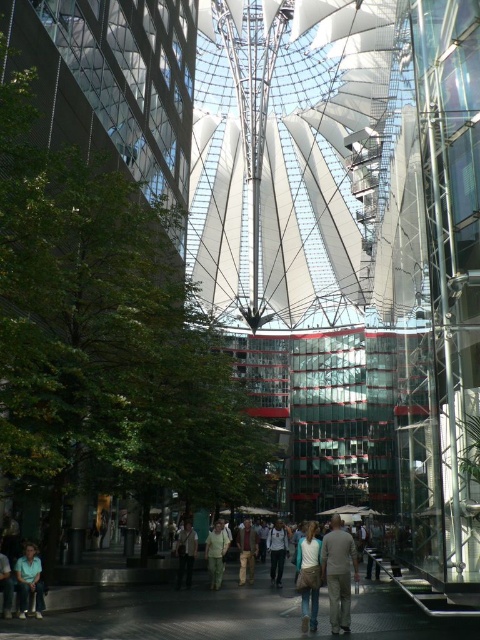
Question: Which point is closer to the camera?

Choices:
 (A) (192, 532)
 (B) (9, 579)
 (C) (310, 592)
 (D) (36, 580)

Answer: (B)

Question: Does denim jacket at center have a larger size compared to light blue jeans at lower left?

Choices:
 (A) no
 (B) yes

Answer: (B)

Question: Based on their relative distances, which object is nearer to the brown leather jacket at center?

Choices:
 (A) denim jacket at center
 (B) light blue shirt at lower left
 (C) light brown leather jacket at center
 (D) light beige pants at center

Answer: (D)

Question: Which of the following is the farthest from the observer?

Choices:
 (A) (284, 557)
 (B) (188, 557)
 (C) (337, 518)
 (D) (2, 611)

Answer: (A)

Question: Can you confirm if light blue shirt at center is positioned to the left of brown leather jacket at center?

Choices:
 (A) no
 (B) yes

Answer: (A)

Question: Does denim jacket at center appear on the left side of light blue shirt at lower left?

Choices:
 (A) no
 (B) yes

Answer: (A)